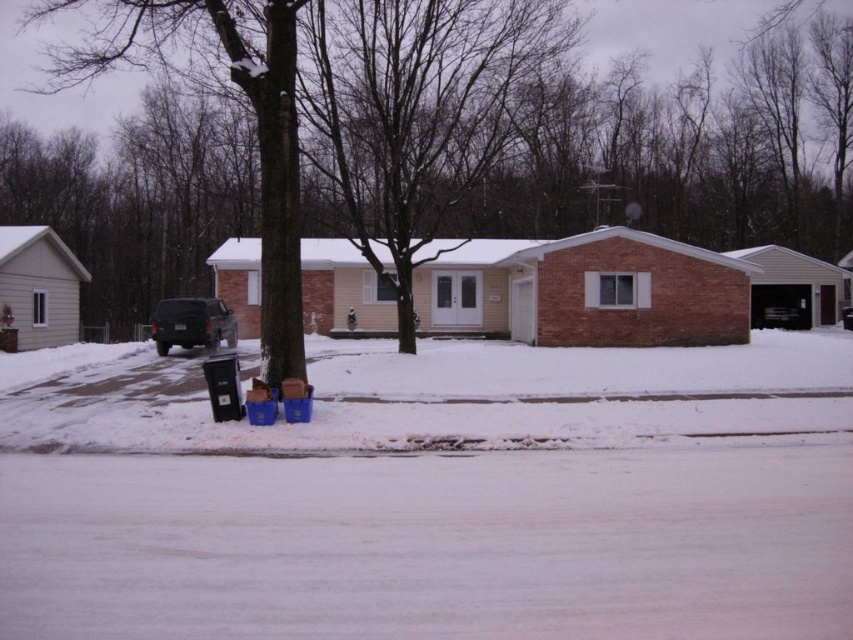
Question: Among these objects, which one is nearest to the camera?

Choices:
 (A) matte black suv at center
 (B) white powdery snow at lower center

Answer: (B)

Question: Is white powdery snow at lower center smaller than matte black suv at center?

Choices:
 (A) no
 (B) yes

Answer: (A)

Question: Which point is closer to the camera?

Choices:
 (A) white powdery snow at lower center
 (B) matte black suv at center

Answer: (A)

Question: Is white powdery snow at lower center smaller than matte black suv at center?

Choices:
 (A) yes
 (B) no

Answer: (B)

Question: Does white powdery snow at lower center have a greater width compared to matte black suv at center?

Choices:
 (A) yes
 (B) no

Answer: (A)